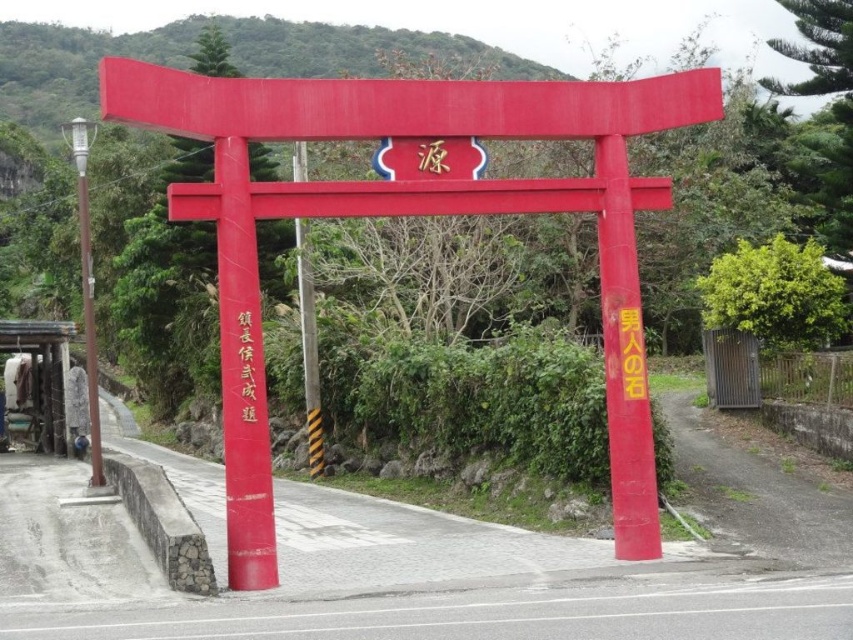
Question: Which of the following is the farthest from the observer?

Choices:
 (A) (299, 220)
 (B) (242, 410)

Answer: (A)

Question: Which point is farther to the camera?

Choices:
 (A) (252, 378)
 (B) (352, 186)
 (C) (312, 397)

Answer: (C)

Question: Which object appears farthest from the camera in this image?

Choices:
 (A) brushed gold characters at center
 (B) yellow-black striped pole at center

Answer: (B)

Question: Does yellow-black striped pole at center appear under brushed gold characters at center?

Choices:
 (A) yes
 (B) no

Answer: (A)

Question: Is matte red torii gate at center thinner than brushed gold characters at center?

Choices:
 (A) yes
 (B) no

Answer: (B)

Question: Can you confirm if matte red torii gate at center is positioned to the right of yellow-black striped pole at center?

Choices:
 (A) yes
 (B) no

Answer: (A)